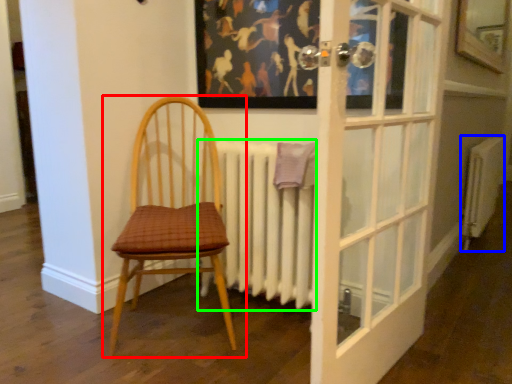
Question: Based on their relative distances, which object is farther from chair (highlighted by a red box)? Choose from radiator (highlighted by a blue box) and radiator (highlighted by a green box).

Choices:
 (A) radiator
 (B) radiator

Answer: (A)